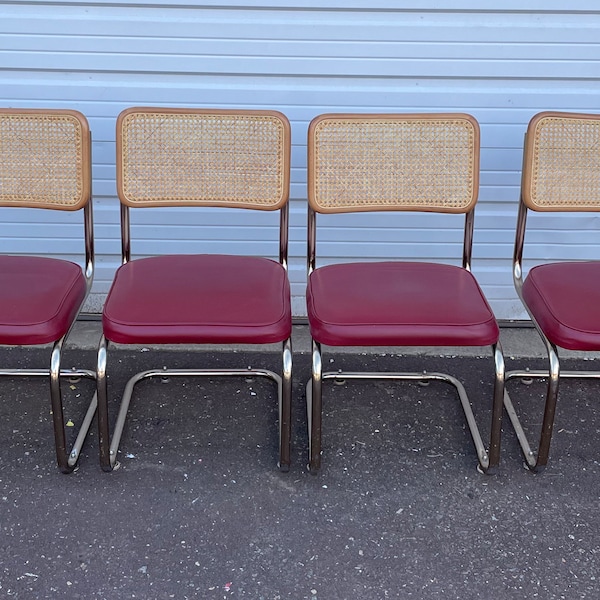
The image size is (600, 600). I want to click on wicker back, so click(x=254, y=158).